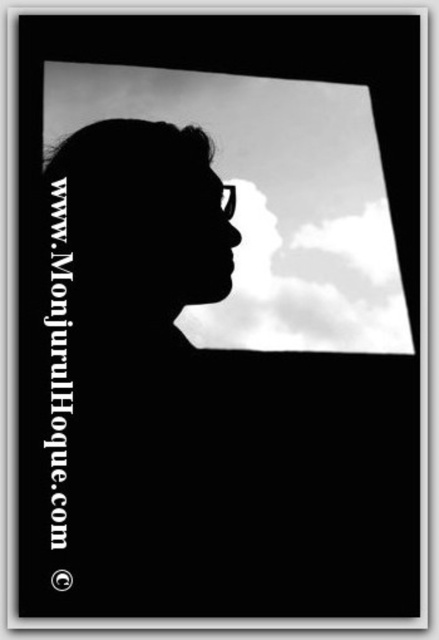
Question: Is cloudy sky at upper center closer to the viewer compared to white fluffy cloud at center?

Choices:
 (A) yes
 (B) no

Answer: (B)

Question: Can you confirm if cloudy sky at upper center is positioned to the right of white fluffy cloud at center?

Choices:
 (A) no
 (B) yes

Answer: (A)

Question: Is cloudy sky at upper center closer to camera compared to white fluffy cloud at center?

Choices:
 (A) no
 (B) yes

Answer: (A)

Question: Which point is farther to the camera?

Choices:
 (A) cloudy sky at upper center
 (B) white fluffy cloud at center

Answer: (A)